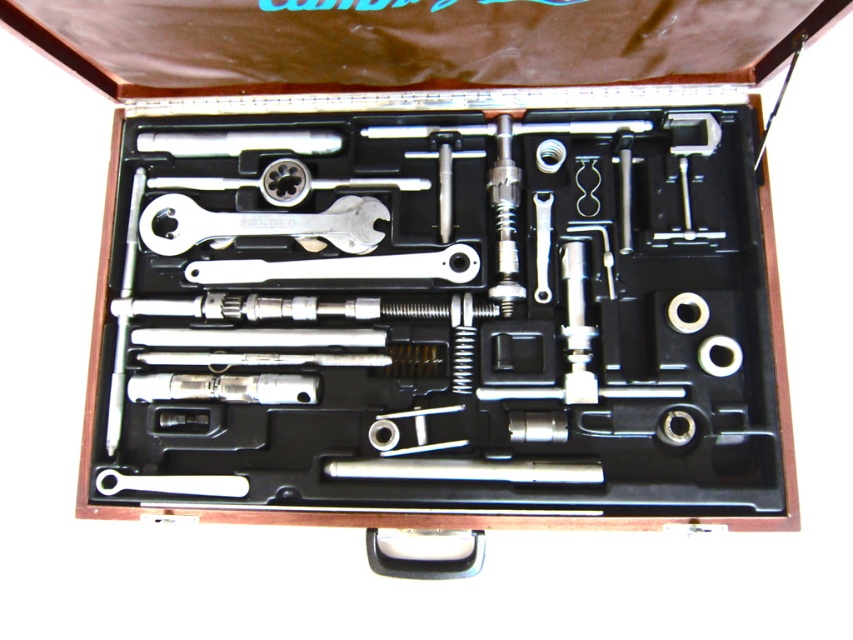
Question: Which point is closer to the camera taking this photo?

Choices:
 (A) (589, 467)
 (B) (202, 486)

Answer: (A)

Question: Which is farther from the white plastic wrench at lower left?

Choices:
 (A) polished metal rod at center
 (B) silver metallic wrench at center
 (C) chrome metallic wrench at center
 (D) polished chrome wrench at center

Answer: (B)

Question: Which object is farther from the camera taking this photo?

Choices:
 (A) polished metal rod at center
 (B) white plastic wrench at lower left

Answer: (B)

Question: Does chrome metallic wrench at center have a greater width compared to polished metal rod at center?

Choices:
 (A) yes
 (B) no

Answer: (B)

Question: Considering the relative positions of polished metal rod at center and silver metallic wrench at center in the image provided, where is polished metal rod at center located with respect to silver metallic wrench at center?

Choices:
 (A) right
 (B) left

Answer: (B)

Question: Does polished chrome wrench at center have a greater width compared to chrome metallic wrench at center?

Choices:
 (A) yes
 (B) no

Answer: (A)